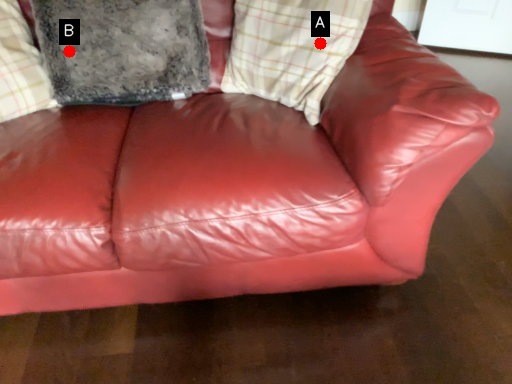
Question: Two points are circled on the image, labeled by A and B beside each circle. Among these points, which one is nearest to the camera?

Choices:
 (A) A is closer
 (B) B is closer

Answer: (A)